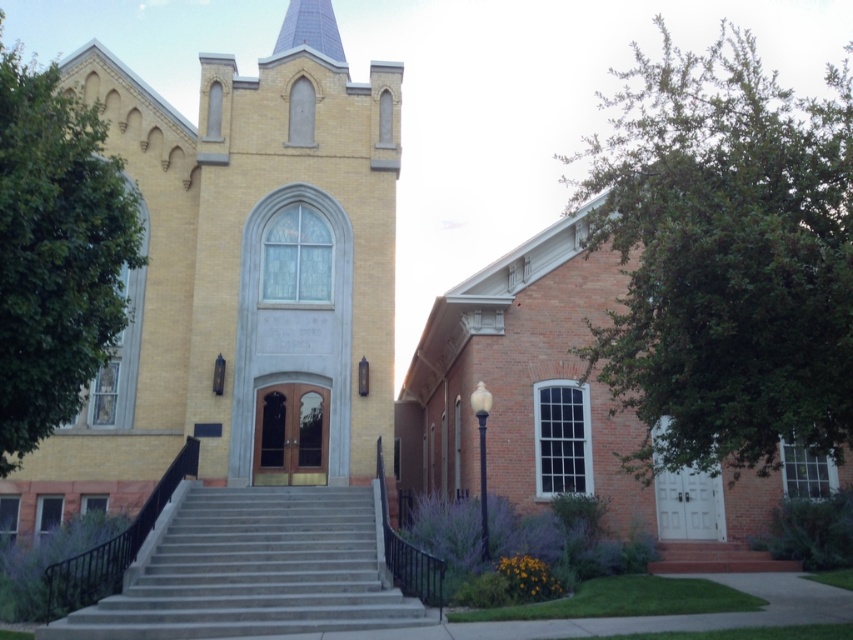
Can you confirm if yellow brick church at center is smaller than shiny blue spire at upper center?

Indeed, yellow brick church at center has a smaller size compared to shiny blue spire at upper center.

Does yellow brick church at center appear on the right side of shiny blue spire at upper center?

Indeed, yellow brick church at center is positioned on the right side of shiny blue spire at upper center.

The height and width of the screenshot is (640, 853). Describe the element at coordinates (238, 288) in the screenshot. I see `yellow brick church at center` at that location.

You are a GUI agent. You are given a task and a screenshot of the screen. Output one action in this format:
    pyautogui.click(x=<x>, y=<y>)
    Task: Click on the yellow brick church at center
    This screenshot has width=853, height=640.
    Given the screenshot: What is the action you would take?
    pyautogui.click(x=238, y=288)

Can you confirm if green leafy tree at left is shorter than gray concrete stairs at center?

No.

Who is higher up, green leafy tree at left or gray concrete stairs at center?

Positioned higher is green leafy tree at left.

Is point (56, 394) closer to camera compared to point (316, 547)?

That is True.

Find the location of a particular element. green leafy tree at left is located at coordinates (55, 252).

Does point (677, 67) come farther from viewer compared to point (300, 26)?

That is True.

Between green leafy tree at right and shiny blue spire at upper center, which one is positioned lower?

green leafy tree at right

This screenshot has width=853, height=640. Describe the element at coordinates (724, 259) in the screenshot. I see `green leafy tree at right` at that location.

You are a GUI agent. You are given a task and a screenshot of the screen. Output one action in this format:
    pyautogui.click(x=<x>, y=<y>)
    Task: Click on the green leafy tree at right
    Image resolution: width=853 pixels, height=640 pixels.
    Given the screenshot: What is the action you would take?
    pyautogui.click(x=724, y=259)